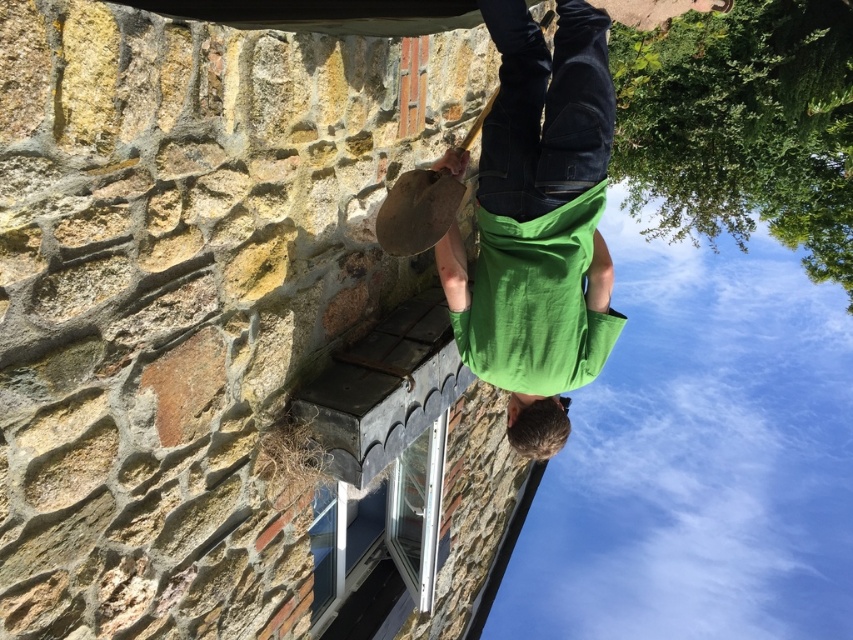
Question: Is green matte skateboard at center wider than white plastic window at lower center?

Choices:
 (A) yes
 (B) no

Answer: (A)

Question: Among these objects, which one is farthest from the camera?

Choices:
 (A) white plastic window at lower center
 (B) green matte skateboard at center

Answer: (A)

Question: Does green matte skateboard at center appear on the left side of white plastic window at lower center?

Choices:
 (A) no
 (B) yes

Answer: (A)

Question: Which point appears farthest from the camera in this image?

Choices:
 (A) (422, 472)
 (B) (573, 289)

Answer: (A)

Question: Does green matte skateboard at center have a greater width compared to white plastic window at lower center?

Choices:
 (A) yes
 (B) no

Answer: (A)